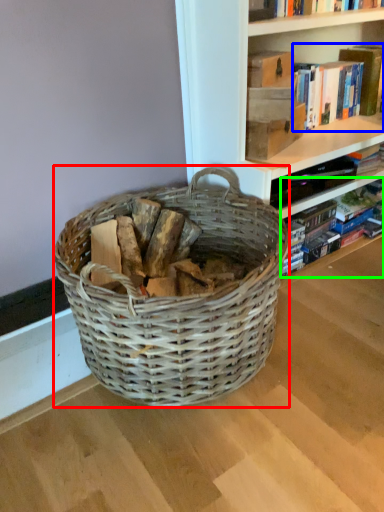
Question: Which object is positioned closest to picnic basket (highlighted by a red box)? Select from book (highlighted by a blue box) and book (highlighted by a green box).

Choices:
 (A) book
 (B) book

Answer: (B)